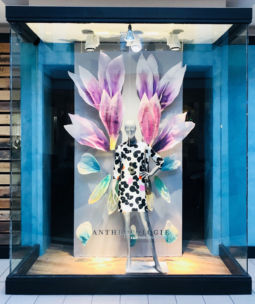
Image resolution: width=255 pixels, height=304 pixels. I want to click on wood panel wall, so click(5, 119).